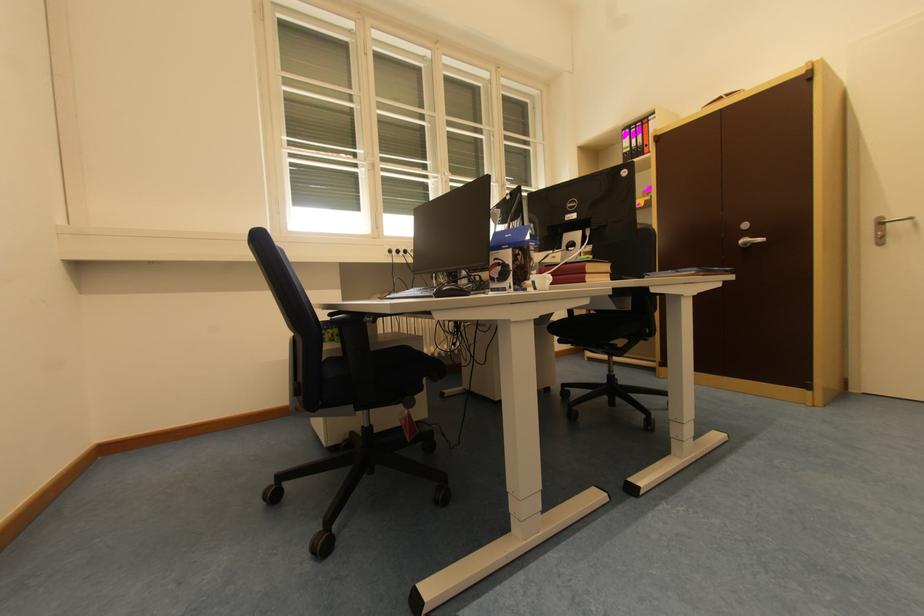
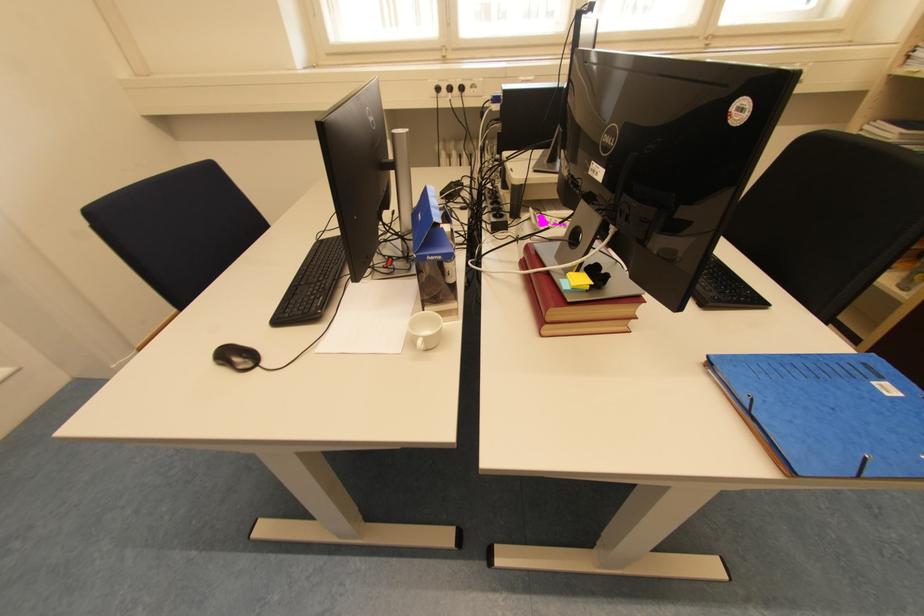
Locate, in the second image, the point that corresponds to [593,273] in the first image.

(555, 321)